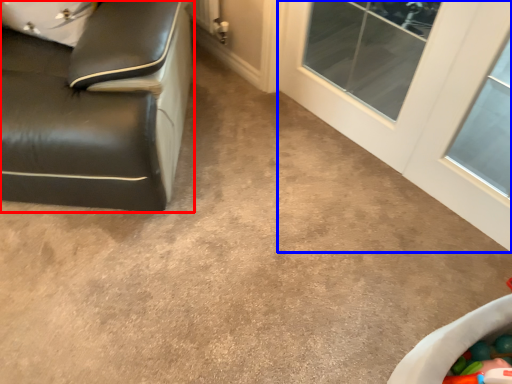
Question: Which of the following is the farthest to the observer, furniture (highlighted by a red box) or glass door (highlighted by a blue box)?

Choices:
 (A) furniture
 (B) glass door

Answer: (B)